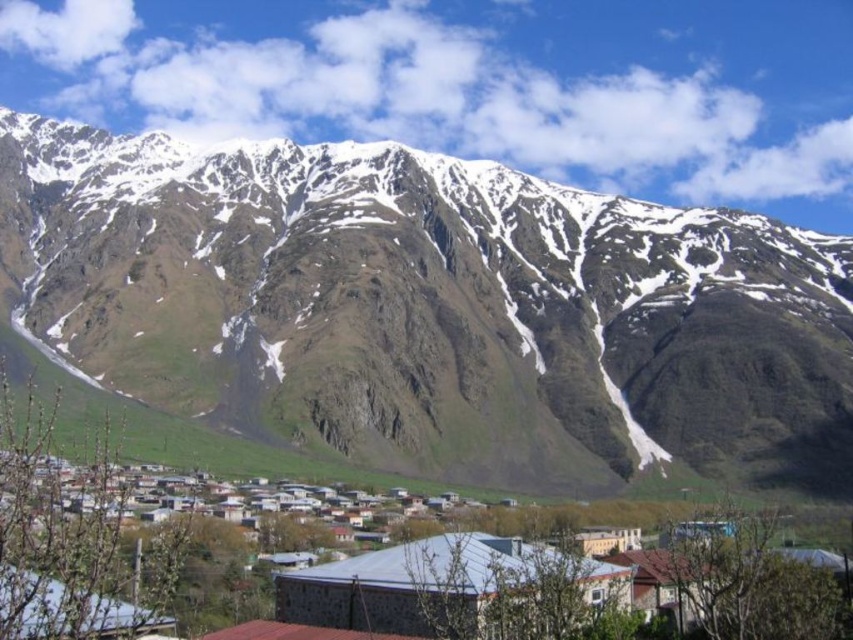
Question: Among these points, which one is nearest to the camera?

Choices:
 (A) (202, 275)
 (B) (85, 524)

Answer: (B)

Question: Is snowy rock mountain at upper center thinner than stone houses at center?

Choices:
 (A) yes
 (B) no

Answer: (B)

Question: Does snowy rock mountain at upper center appear over stone houses at center?

Choices:
 (A) yes
 (B) no

Answer: (A)

Question: Is snowy rock mountain at upper center positioned before stone houses at center?

Choices:
 (A) yes
 (B) no

Answer: (B)